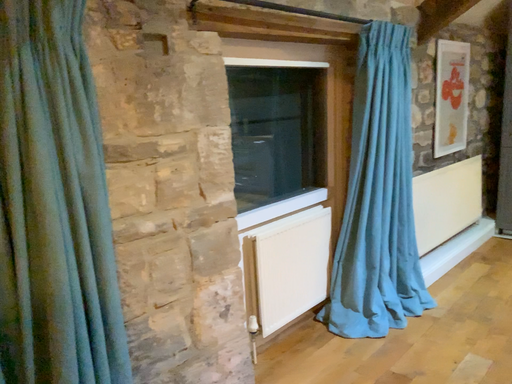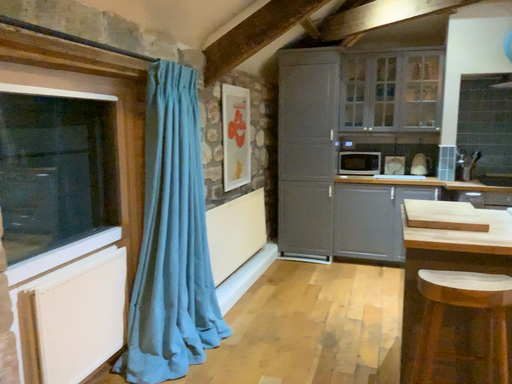
Question: Which way did the camera rotate in the video?

Choices:
 (A) rotated left
 (B) rotated right

Answer: (B)